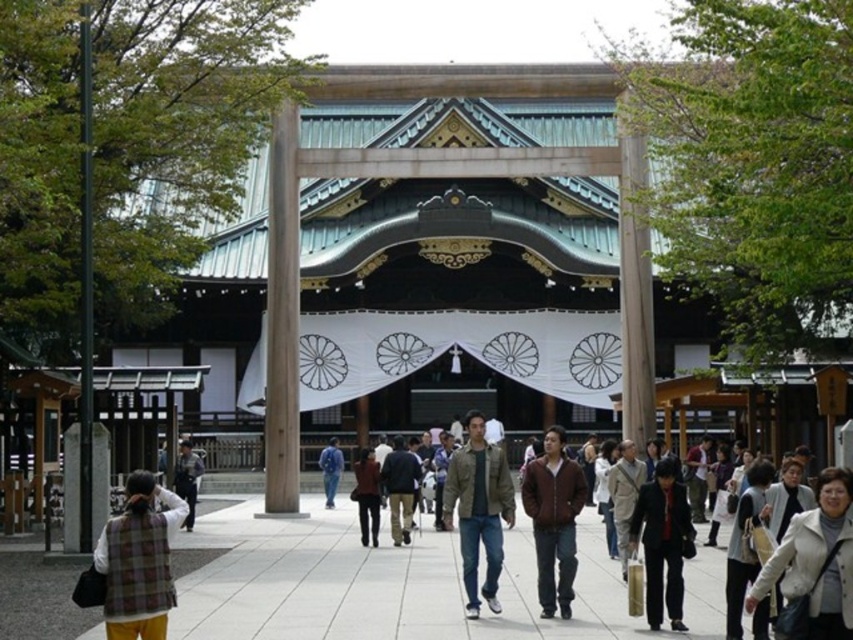
You are a photographer standing at the torii gate entrance. You notice two jackets on the pathway ahead. The white leather jacket at lower right and the brown leather jacket at center. Which jacket should you focus on if you want to capture the larger one in your shot?

The white leather jacket at lower right is larger in size than the brown leather jacket at center, so you should focus on the white leather jacket at lower right to capture the larger one.

You are a photographer standing at the torii gate entrance. You notice two people wearing jackets on the pathway in front of you. Which jacket, the white leather jacket at lower right or the dark brown leather jacket at lower right, is shorter in height?

The white leather jacket at lower right has a lesser height compared to the dark brown leather jacket at lower right, so the white leather jacket at lower right is shorter in height.

You are standing at the torii gate entrance and want to walk towards the shrine. There are two points marked on the ground ahead of you. Which point should you step on first if you need to follow the correct path order? Please choose between point A at point coordinate (846,493) and point B at (737,532).

You should step on point A at point coordinate (846,493) first because it is in front of point B at (737,532) according to the spatial arrangement.